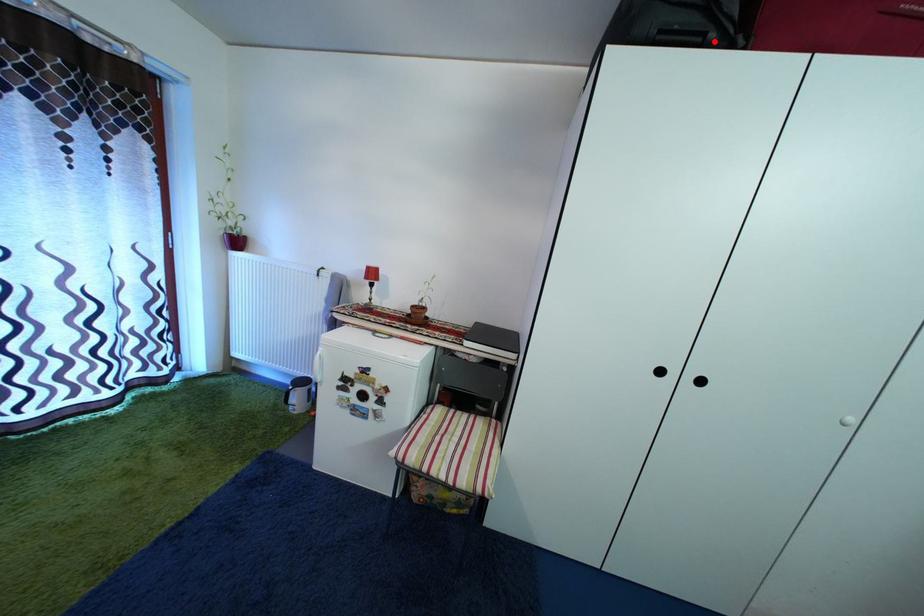
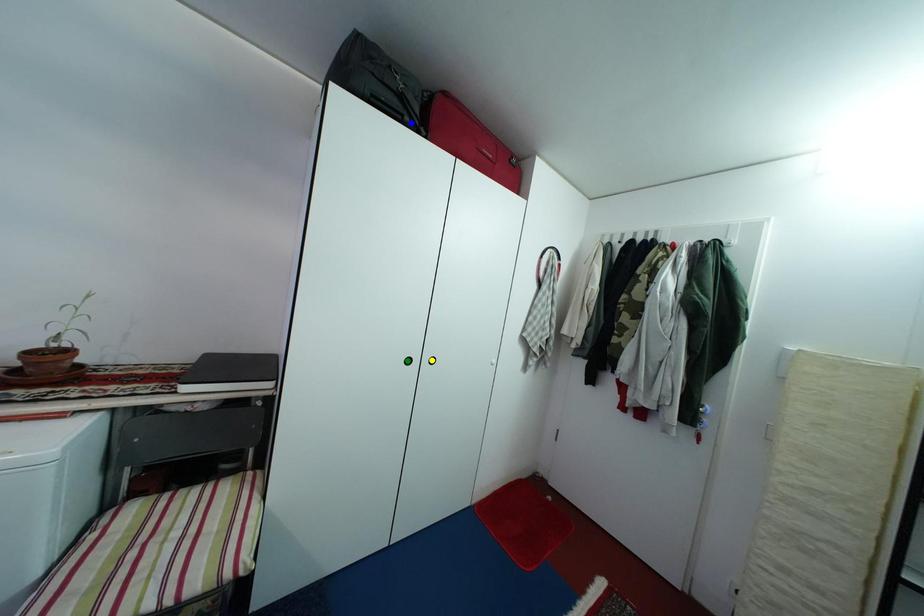
Question: I am providing you with two images of the same scene from different viewpoints. A red point is marked on the first image. You are given multiple points on the second image. In image 2, which mark is for the same physical point as the one in image 1?

Choices:
 (A) blue point
 (B) green point
 (C) yellow point

Answer: (A)